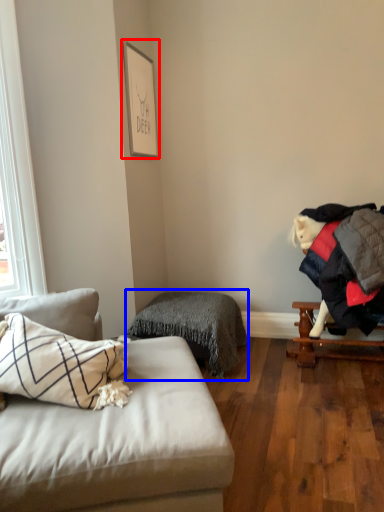
Question: Which point is closer to the camera, picture frame (highlighted by a red box) or bedding (highlighted by a blue box)?

Choices:
 (A) picture frame
 (B) bedding

Answer: (B)